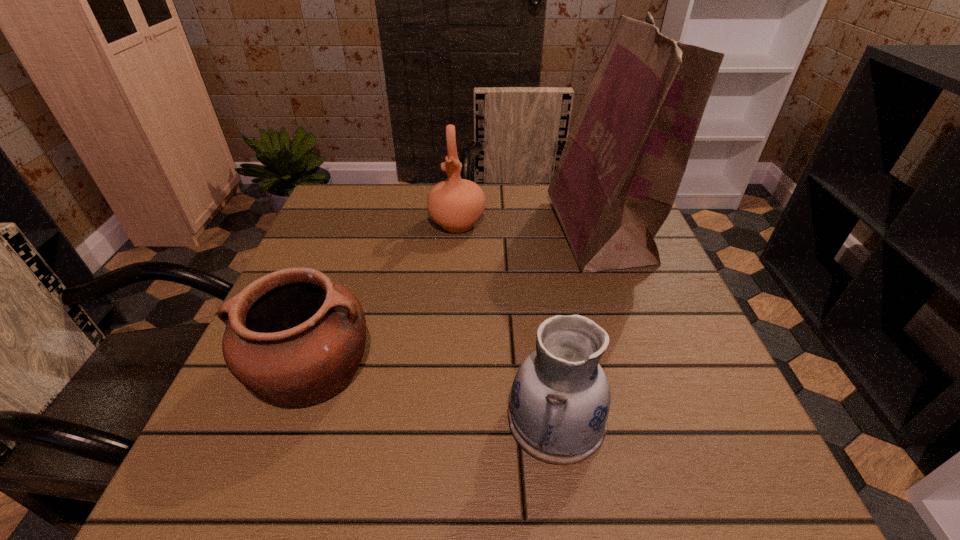
You are a GUI agent. You are given a task and a screenshot of the screen. Output one action in this format:
    pyautogui.click(x=<x>, y=<y>)
    Task: Click on the free space at the near edge of the desktop
    The image size is (960, 540).
    Given the screenshot: What is the action you would take?
    pyautogui.click(x=515, y=460)

In the image, there is a desktop. Where is `vacant space at the right edge`? vacant space at the right edge is located at coordinates [660, 265].

The width and height of the screenshot is (960, 540). I want to click on vacant space at the near left corner of the desktop, so click(269, 485).

Where is `empty space between the rightmost pottery and the shortest pottery`? This screenshot has height=540, width=960. empty space between the rightmost pottery and the shortest pottery is located at coordinates (434, 393).

This screenshot has width=960, height=540. I want to click on vacant area that lies between the second object from left to right and the rightmost pottery, so click(507, 321).

This screenshot has width=960, height=540. I want to click on free spot between the farthest pottery and the shortest object, so click(x=384, y=295).

What are the coordinates of `vacant space that is in between the grocery bag and the leftmost object` in the screenshot? It's located at (455, 300).

Where is `unoccupied area between the farthest pottery and the grocery bag`? unoccupied area between the farthest pottery and the grocery bag is located at coordinates (528, 228).

Locate an element on the screen. The height and width of the screenshot is (540, 960). empty space that is in between the tallest object and the second pottery from left to right is located at coordinates (528, 228).

Locate an element on the screen. This screenshot has width=960, height=540. vacant area that lies between the tallest object and the farthest pottery is located at coordinates (528, 228).